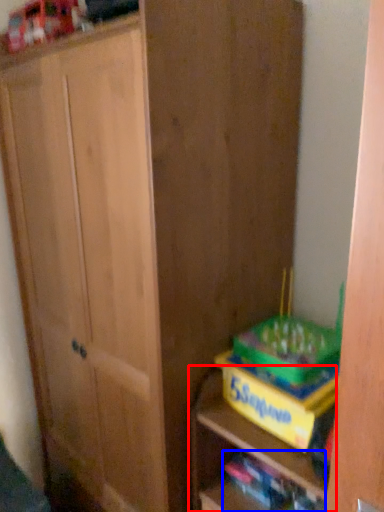
Question: Which point is further to the camera, shelf (highlighted by a red box) or book (highlighted by a blue box)?

Choices:
 (A) shelf
 (B) book

Answer: (B)